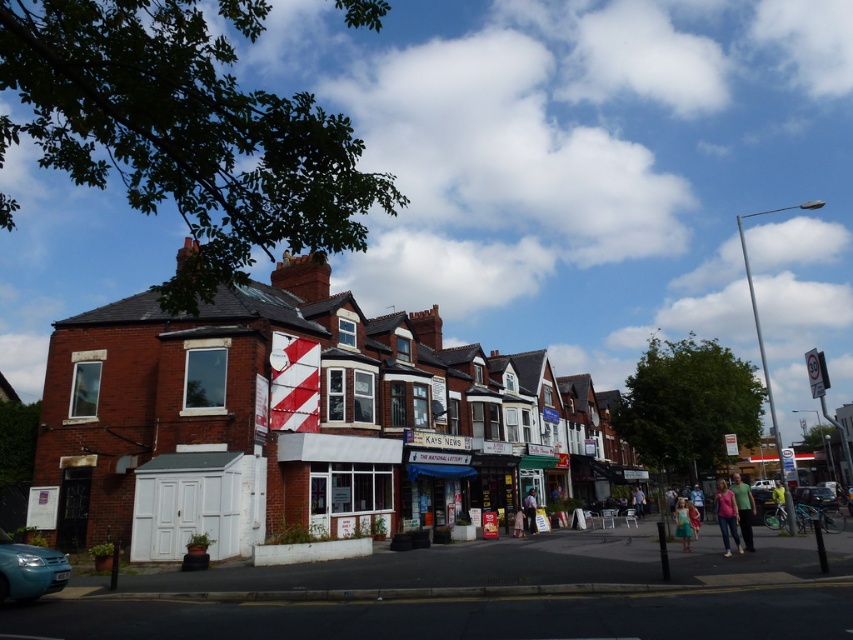
Does point (531, 490) come farther from viewer compared to point (763, 483)?

That is False.

Does pastel pink dress at center appear under metallic silver van at center?

No.

Who is more forward, (523, 500) or (758, 484)?

Positioned in front is point (523, 500).

This screenshot has height=640, width=853. Identify the location of pastel pink dress at center. (531, 509).

Looking at this image, is red brick building at center shorter than green cotton shirt at lower right?

Incorrect, red brick building at center's height does not fall short of green cotton shirt at lower right's.

Which is behind, point (292, 317) or point (747, 520)?

The point (292, 317) is more distant.

This screenshot has height=640, width=853. Find the location of `red brick building at center`. red brick building at center is located at coordinates (294, 420).

Can you confirm if green cotton shirt at lower right is bigger than green fabric dress at lower center?

Correct, green cotton shirt at lower right is larger in size than green fabric dress at lower center.

Is green cotton shirt at lower right positioned at the back of green fabric dress at lower center?

No, green cotton shirt at lower right is in front of green fabric dress at lower center.

Which is behind, point (740, 525) or point (685, 524)?

The point (685, 524) is more distant.

This screenshot has width=853, height=640. I want to click on green cotton shirt at lower right, so click(743, 508).